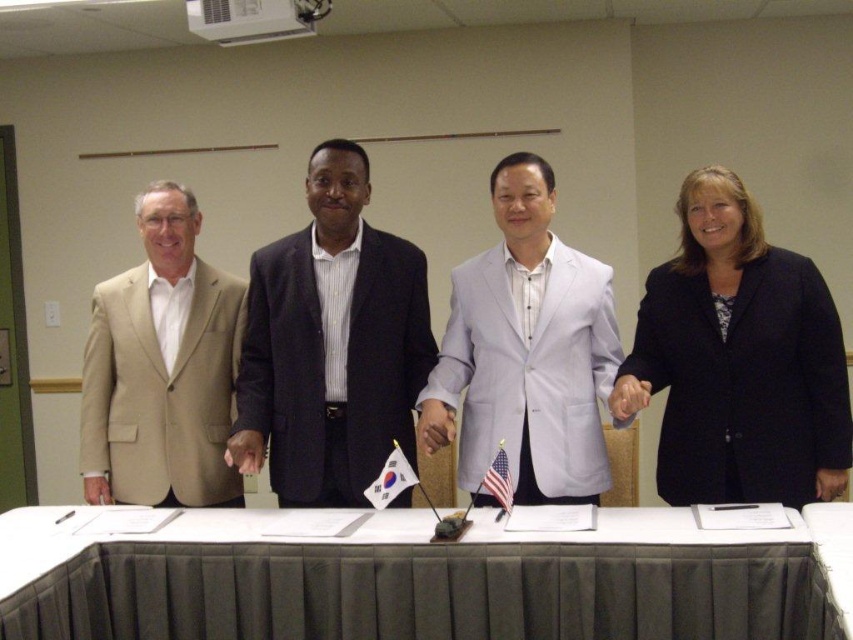
Does white fabric table at center have a greater width compared to black matte blazer at right?

Yes, white fabric table at center is wider than black matte blazer at right.

Can you confirm if white fabric table at center is positioned to the right of black matte blazer at right?

Incorrect, white fabric table at center is not on the right side of black matte blazer at right.

What do you see at coordinates (422, 577) in the screenshot?
I see `white fabric table at center` at bounding box center [422, 577].

Identify the location of white fabric table at center. This screenshot has width=853, height=640. (422, 577).

Who is more forward, (393,282) or (393,493)?

Positioned in front is point (393,493).

Does dark blue suit at center have a larger size compared to white fabric flag at center?

Yes.

Does point (390, 300) come behind point (393, 472)?

Yes, it is.

This screenshot has height=640, width=853. In order to click on dark blue suit at center in this screenshot , I will do `click(331, 344)`.

Can you confirm if black matte blazer at right is thinner than white fabric flag at center?

In fact, black matte blazer at right might be wider than white fabric flag at center.

Is black matte blazer at right above white fabric flag at center?

Indeed, black matte blazer at right is positioned over white fabric flag at center.

Is point (679, 301) in front of point (405, 480)?

No.

Identify the location of black matte blazer at right. (738, 360).